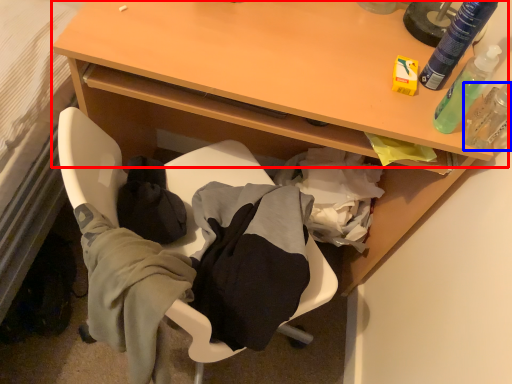
Question: Which object appears farthest to the camera in this image, table (highlighted by a red box) or toiletry (highlighted by a blue box)?

Choices:
 (A) table
 (B) toiletry

Answer: (A)